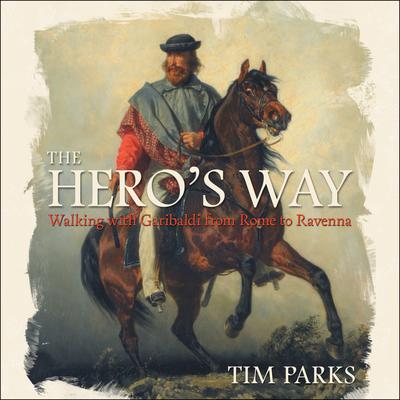
The image size is (400, 400). I want to click on plaid red and white cloth, so click(136, 129).